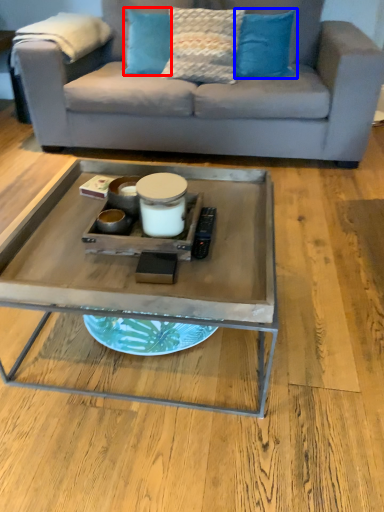
Question: Which point is closer to the camera, pillow (highlighted by a red box) or pillow (highlighted by a blue box)?

Choices:
 (A) pillow
 (B) pillow

Answer: (B)